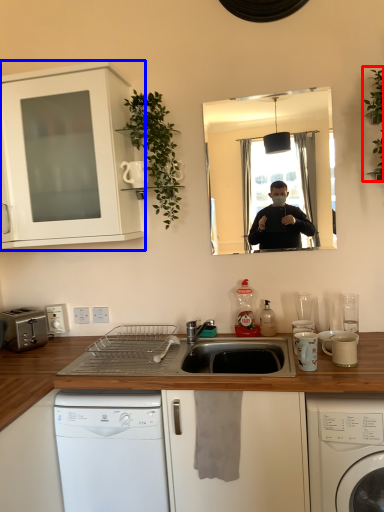
Question: Which object appears closest to the camera in this image, plant (highlighted by a red box) or cabinetry (highlighted by a blue box)?

Choices:
 (A) plant
 (B) cabinetry

Answer: (A)